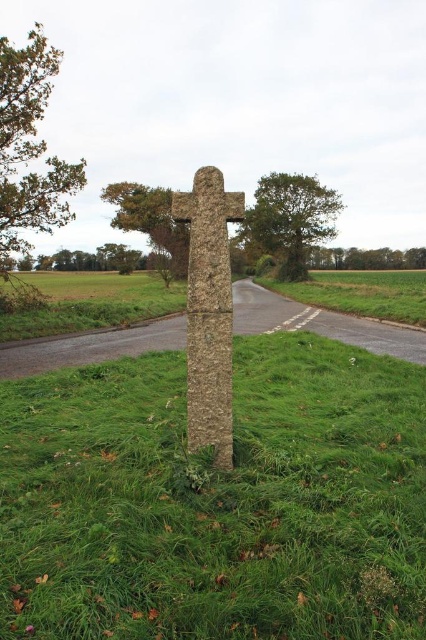
Question: Is green grassy at center bigger than green leafy tree at upper left?

Choices:
 (A) no
 (B) yes

Answer: (A)

Question: Can you confirm if green grassy at center is positioned above green leafy tree at upper left?

Choices:
 (A) yes
 (B) no

Answer: (B)

Question: Is rough stone cross at center smaller than green leafy tree at upper left?

Choices:
 (A) yes
 (B) no

Answer: (A)

Question: Among these objects, which one is nearest to the camera?

Choices:
 (A) green leafy tree at upper left
 (B) green leafy tree at upper center
 (C) green leafy tree at center

Answer: (B)

Question: Based on their relative distances, which object is nearer to the rough stone cross at center?

Choices:
 (A) green leafy tree at center
 (B) green leafy tree at upper center
 (C) green leafy tree at upper left
 (D) green grassy at center

Answer: (D)

Question: Which of the following is the farthest from the observer?

Choices:
 (A) rough stone cross at center
 (B) green leafy tree at center
 (C) green leafy tree at upper left
 (D) green grassy at center

Answer: (B)